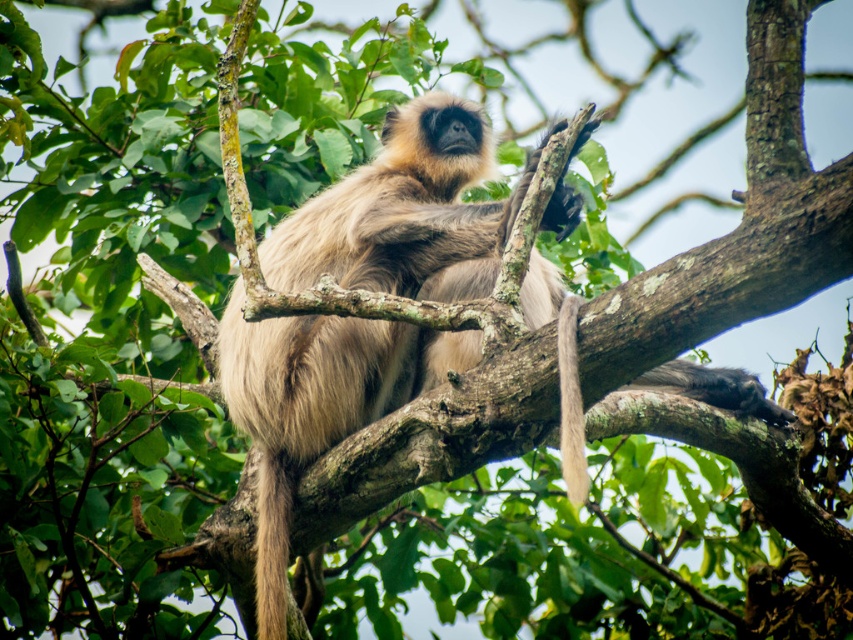
You are an animal researcher observing a langur monkey in a tropical forest. You notice two tails in the scene. Which tail is wider? The fuzzy brown tail at lower left or the fuzzy beige tail at center?

The fuzzy brown tail at lower left might be wider than fuzzy beige tail at center according to the description.

You are a wildlife photographer aiming to capture the langur monkey in the image. You notice two fuzzy tails in the scene. Which tail is closer to the camera, the fuzzy brown tail at lower left or the fuzzy beige tail at center?

The fuzzy beige tail at center is closer to the camera because the fuzzy brown tail at lower left is positioned under it.

You are a wildlife photographer aiming to capture a closeup shot of the light brown fur monkey at center. You have a camera with a maximum zoom range of 10 feet. Can you get a clear closeup without moving closer physically?

The light brown fur monkey at center is 13.60 feet away from the camera. Since the maximum zoom range is 10 feet, the camera cannot capture a clear closeup at this distance without moving closer physically.